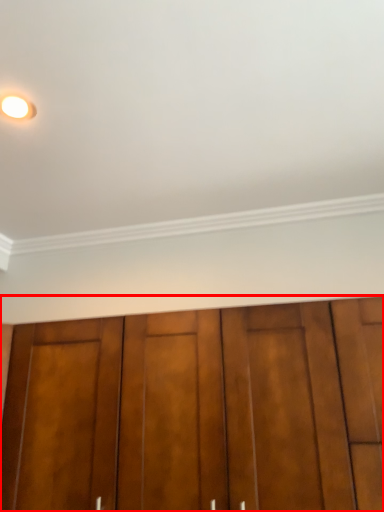
Question: From the image's perspective, where is door (annotated by the red box) located in relation to lighting in the image?

Choices:
 (A) below
 (B) above

Answer: (A)